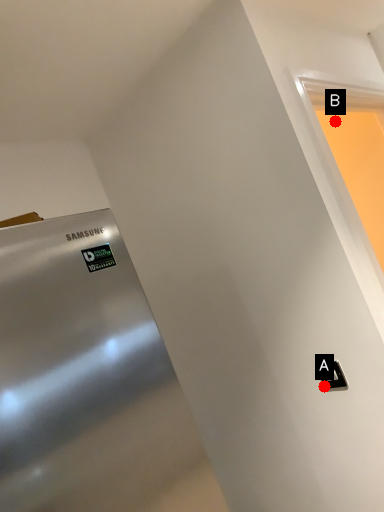
Question: Two points are circled on the image, labeled by A and B beside each circle. Among these points, which one is farthest from the camera?

Choices:
 (A) A is further
 (B) B is further

Answer: (B)